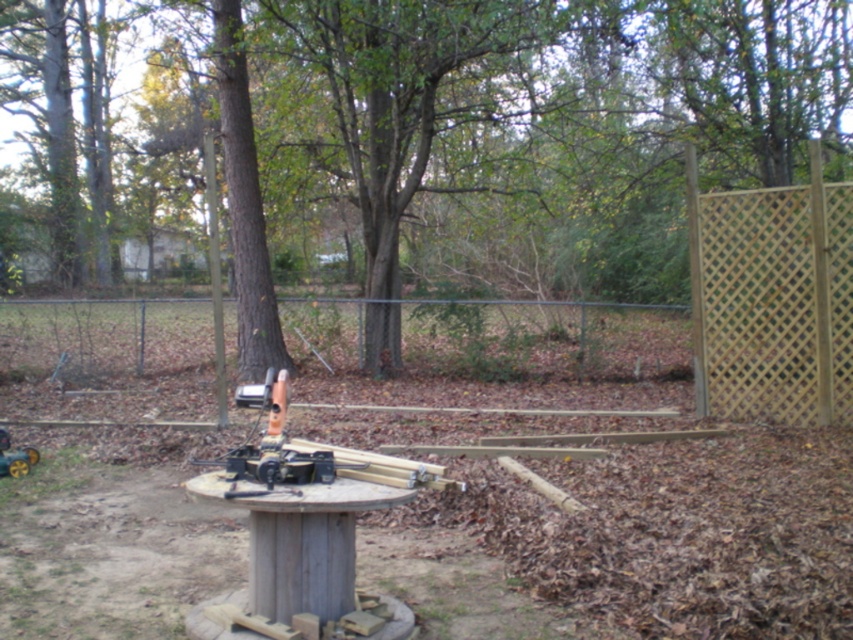
Question: Which object appears farthest from the camera in this image?

Choices:
 (A) light brown lattice fence at right
 (B) wooden lattice fence at center
 (C) brown wood tree at center

Answer: (B)

Question: Which object appears closest to the camera in this image?

Choices:
 (A) light brown lattice fence at right
 (B) wooden lattice fence at center
 (C) brown wood tree at center

Answer: (A)

Question: Can you confirm if brown wood tree at center is positioned above wooden lattice fence at center?

Choices:
 (A) no
 (B) yes

Answer: (B)

Question: Is brown wood tree at center thinner than light brown lattice fence at right?

Choices:
 (A) no
 (B) yes

Answer: (A)

Question: Estimate the real-world distances between objects in this image. Which object is closer to the brown wood tree at center?

Choices:
 (A) wooden lattice fence at center
 (B) light brown lattice fence at right

Answer: (A)

Question: Can you confirm if brown wood tree at center is positioned to the left of wooden lattice fence at center?

Choices:
 (A) no
 (B) yes

Answer: (B)